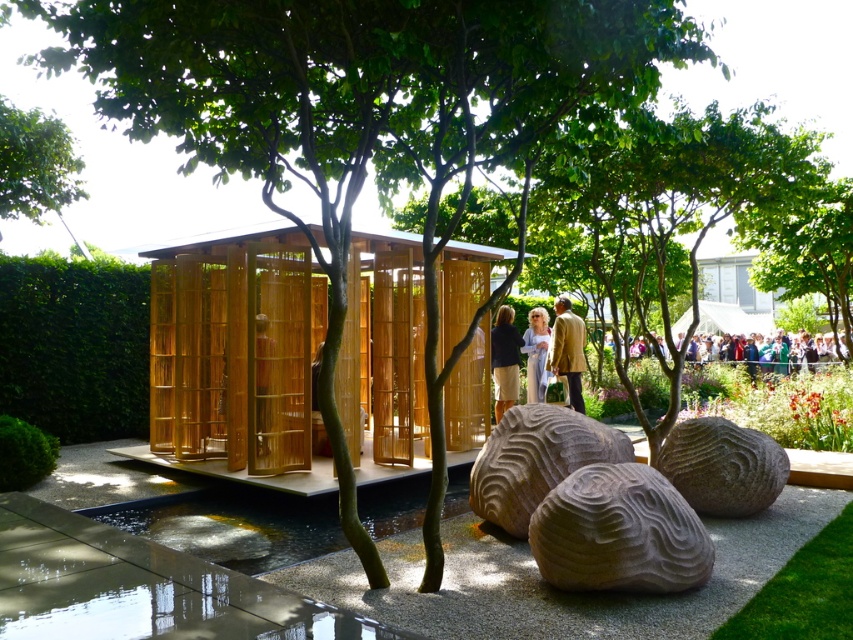
Which is more to the left, gray stone boulder at center or green leafy tree at upper right?

From the viewer's perspective, gray stone boulder at center appears more on the left side.

Can you confirm if gray stone boulder at center is positioned to the right of green leafy tree at upper right?

In fact, gray stone boulder at center is to the left of green leafy tree at upper right.

The image size is (853, 640). Identify the location of gray stone boulder at center. (537, 460).

Is green leafy tree at upper left below white textured dress at center?

Incorrect, green leafy tree at upper left is not positioned below white textured dress at center.

Is the position of green leafy tree at upper left more distant than that of white textured dress at center?

No.

You are a GUI agent. You are given a task and a screenshot of the screen. Output one action in this format:
    pyautogui.click(x=<x>, y=<y>)
    Task: Click on the green leafy tree at upper left
    The width and height of the screenshot is (853, 640).
    Given the screenshot: What is the action you would take?
    click(x=35, y=163)

The image size is (853, 640). I want to click on green leafy tree at upper left, so click(x=35, y=163).

Is green leafy tree at upper right above dark brown leather jacket at center?

Indeed, green leafy tree at upper right is positioned over dark brown leather jacket at center.

Is green leafy tree at upper right positioned behind dark brown leather jacket at center?

No, green leafy tree at upper right is closer to the viewer.

You are a GUI agent. You are given a task and a screenshot of the screen. Output one action in this format:
    pyautogui.click(x=<x>, y=<y>)
    Task: Click on the green leafy tree at upper right
    
    Given the screenshot: What is the action you would take?
    pyautogui.click(x=805, y=248)